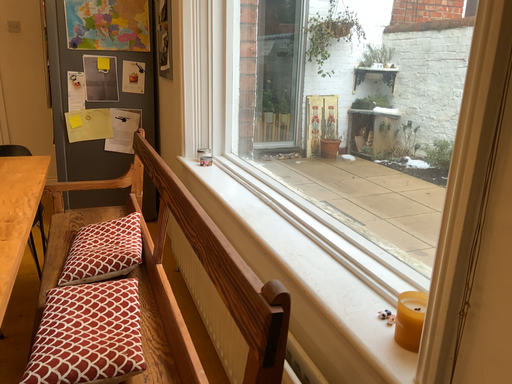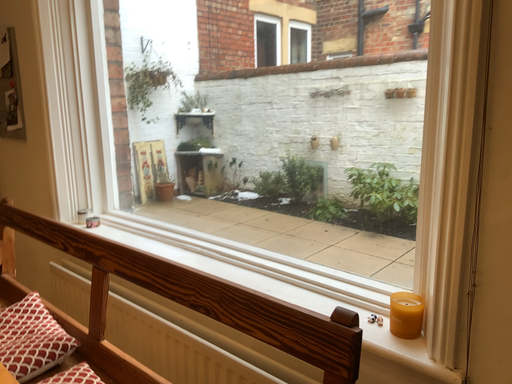
Question: How did the camera likely rotate when shooting the video?

Choices:
 (A) rotated upward
 (B) rotated downward

Answer: (A)